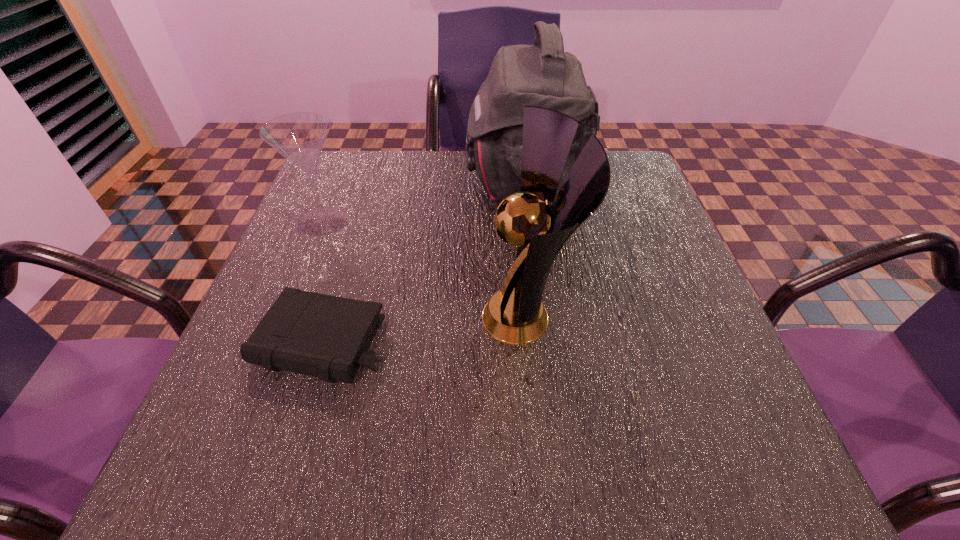
Choose which object is the nearest neighbor to the flute glass. Please provide its 2D coordinates. Your answer should be formatted as a tuple, i.e. [(x, y)], where the tuple contains the x and y coordinates of a point satisfying the conditions above.

[(324, 336)]

Locate an element on the screen. object that is the third nearest to the shortest object is located at coordinates (543, 75).

I want to click on vacant area that satisfies the following two spatial constraints: 1. on the open flap of the shoulder bag; 2. on the front side of the shortest object, so click(x=545, y=342).